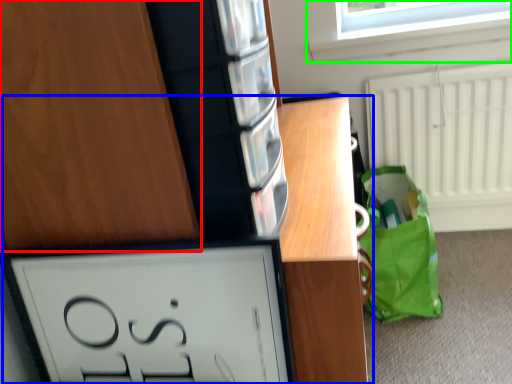
Question: Which object is positioned closest to cabinetry (highlighted by a red box)? Select from vanity (highlighted by a blue box) and window (highlighted by a green box).

Choices:
 (A) vanity
 (B) window

Answer: (A)